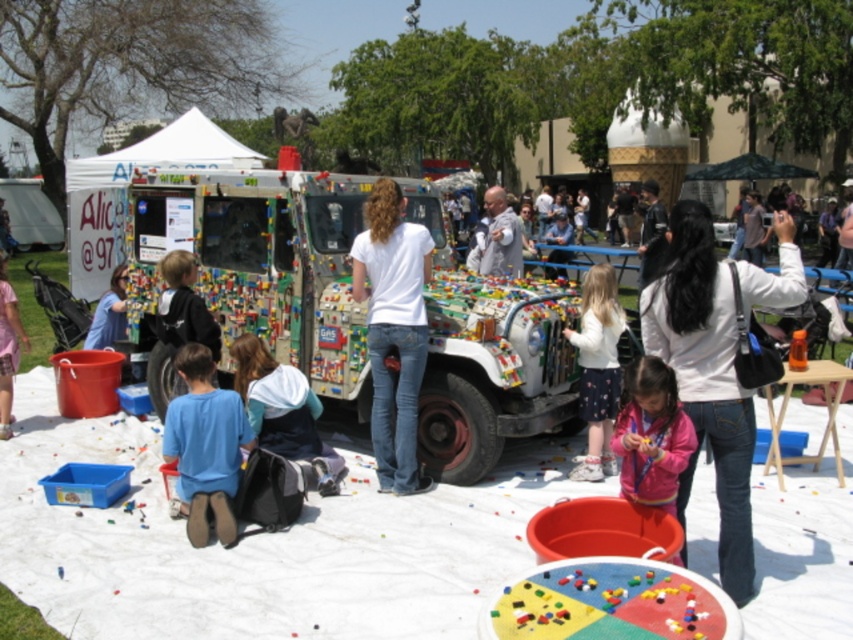
You are a photographer standing in front of the LEGO fire truck. You notice two points marked on the truck. One is at coordinate point (345, 272) and the other at point (618, 604). Which point is closer to your camera?

Point (345, 272) is closer to the camera than point (618, 604) because it is further to the camera according to the description.